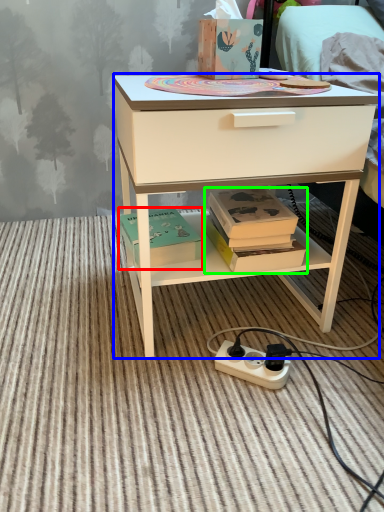
Question: Which object is positioned farthest from box (highlighted by a red box)? Select from desk (highlighted by a blue box) and book (highlighted by a green box).

Choices:
 (A) desk
 (B) book

Answer: (A)